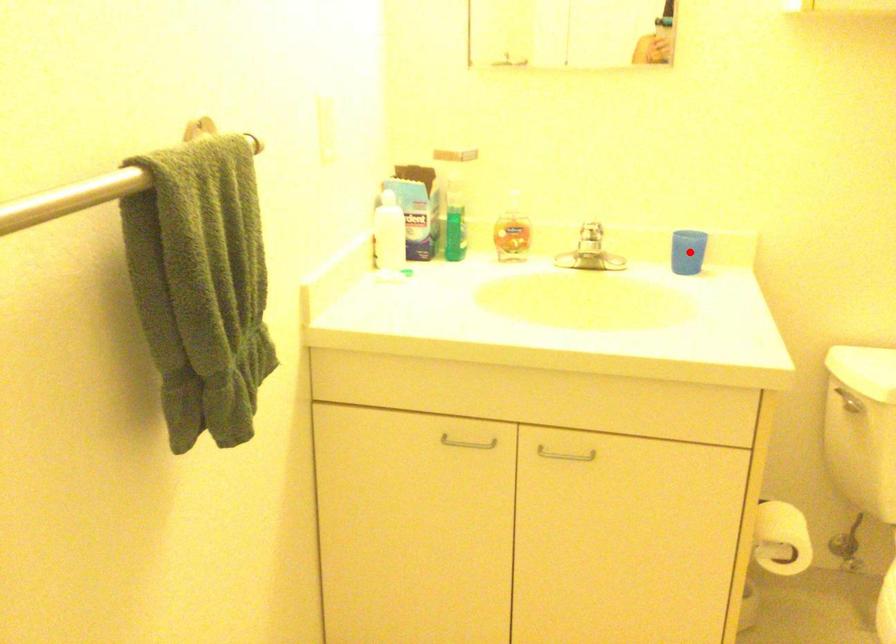
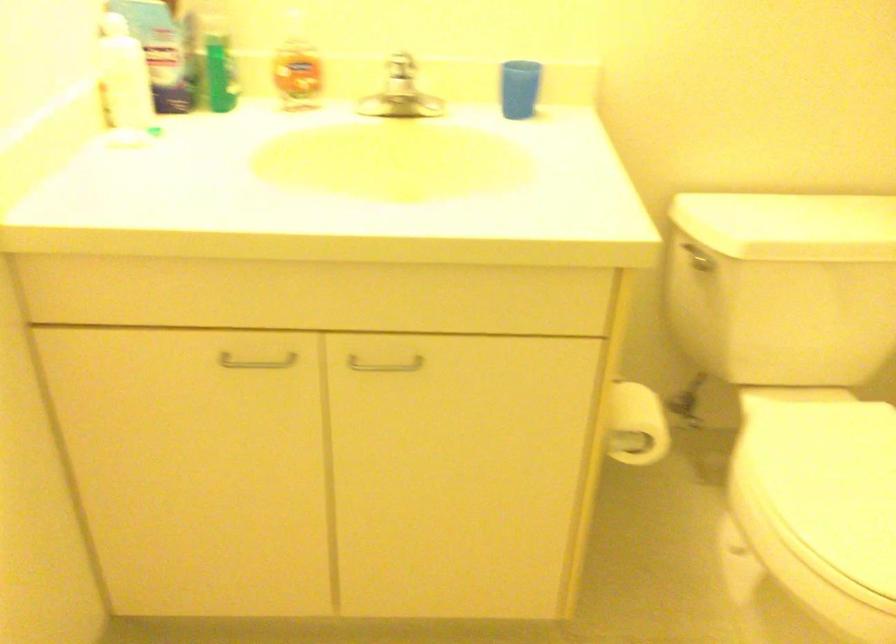
Question: I am providing you with two images of the same scene from different viewpoints. A red point is shown in image1. For the corresponding object point in image2, is it positioned nearer or farther from the camera?

Choices:
 (A) Nearer
 (B) Farther

Answer: (A)